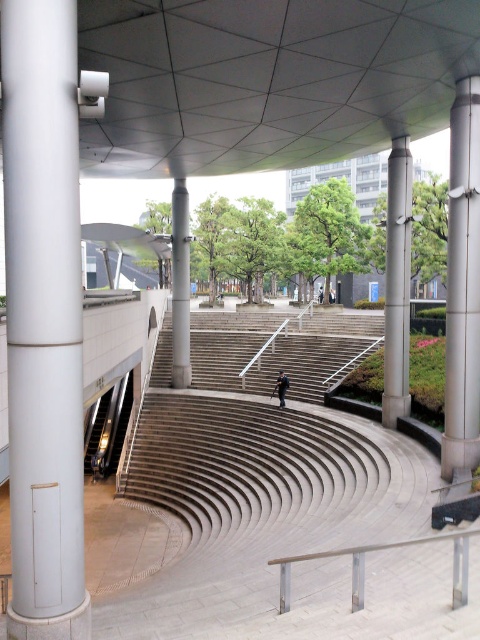
You are standing in the plaza and want to take a photo of both the point at coordinates point [167,320] and point [181,189]. Which point should you focus on first to ensure both are in sharp focus?

You should focus on point [181,189] first because it is closer to the camera than point [167,320]. By focusing on the closer point, the farther point will also be in focus due to the depth of field.

You are standing at the top of the smooth concrete stairs at center and want to walk towards the satin silver column at center. Which direction should you face to move towards it?

The smooth concrete stairs at center is closer to the viewer than the satin silver column at center, so you should face downward towards the satin silver column at center to move towards it.

You are a delivery person with a cart that can move freely on the tiered steps. You need to transport a package from the dark blue matte skateboard at center to the satin silver pole at center right. Given that the steps are tiered and the distance between them is 26.42 feet, can you estimate how many steps you would have to descend to reach the pole from the skateboard?

The satin silver pole at center right is 26.42 feet away from the dark blue matte skateboard at center. Assuming each step is approximately 1 foot in depth, you would need to descend about 26 steps to reach the pole from the skateboard.